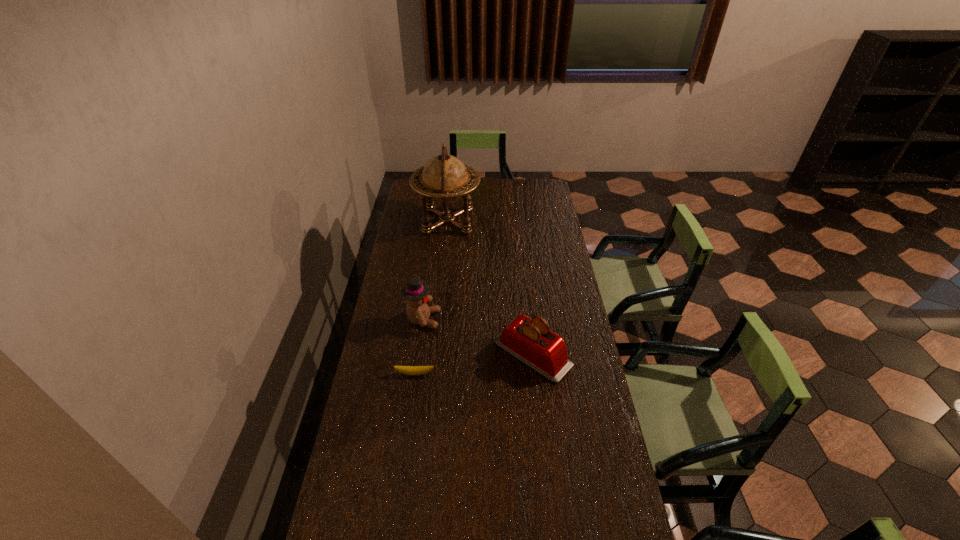
In order to click on blank area in the image that satisfies the following two spatial constraints: 1. on the back side of the banana; 2. on the right side of the toaster in this screenshot , I will do `click(418, 354)`.